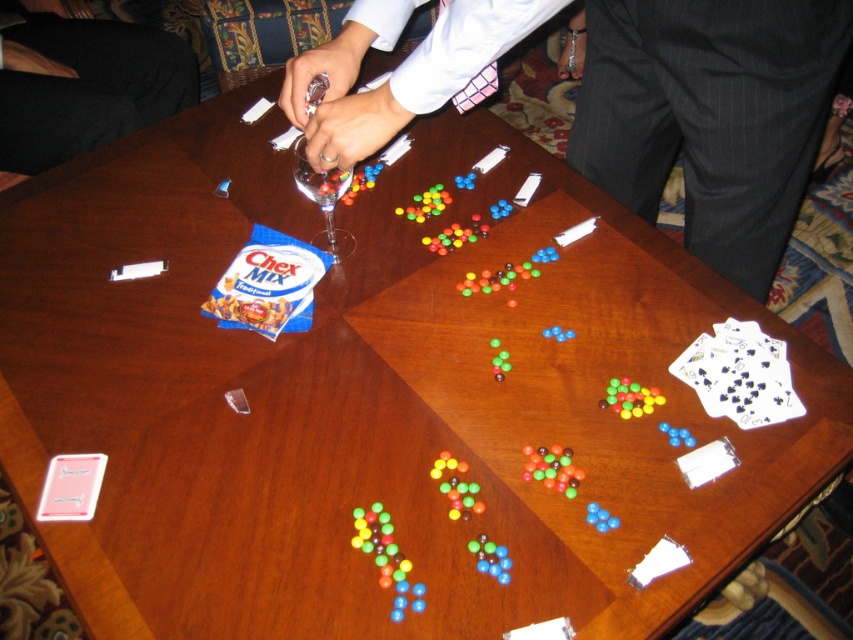
What do you see at coordinates (711, 115) in the screenshot? I see `white shirt at center` at bounding box center [711, 115].

Can you confirm if white shirt at center is positioned above white paper cards at lower right?

Yes, white shirt at center is above white paper cards at lower right.

Between point (618, 168) and point (770, 387), which one is positioned in front?

Point (770, 387)

Identify the location of white shirt at center. This screenshot has width=853, height=640. (711, 115).

Does shiny plastic beads at center have a larger size compared to translucent plastic beads at bottom center?

Correct, shiny plastic beads at center is larger in size than translucent plastic beads at bottom center.

Is point (553, 465) more distant than point (497, 560)?

Yes, point (553, 465) is behind point (497, 560).

The width and height of the screenshot is (853, 640). Identify the location of shiny plastic beads at center. (552, 468).

Is white paper cards at lower right below shiny plastic beads at center?

Actually, white paper cards at lower right is above shiny plastic beads at center.

Who is positioned more to the left, white paper cards at lower right or shiny plastic beads at center?

shiny plastic beads at center is more to the left.

Image resolution: width=853 pixels, height=640 pixels. In order to click on white paper cards at lower right in this screenshot , I will do `click(740, 374)`.

Image resolution: width=853 pixels, height=640 pixels. I want to click on white paper cards at lower right, so click(x=740, y=374).